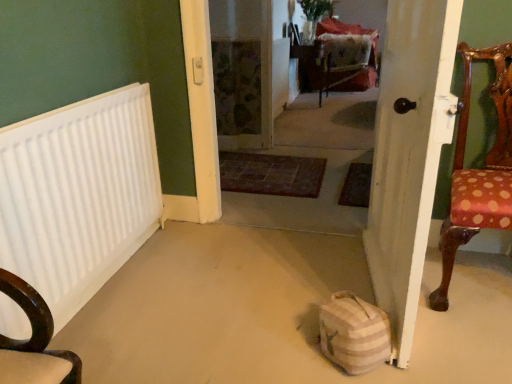
This screenshot has width=512, height=384. I want to click on vacant area situated below white matte radiator at left (from a real-world perspective), so click(103, 291).